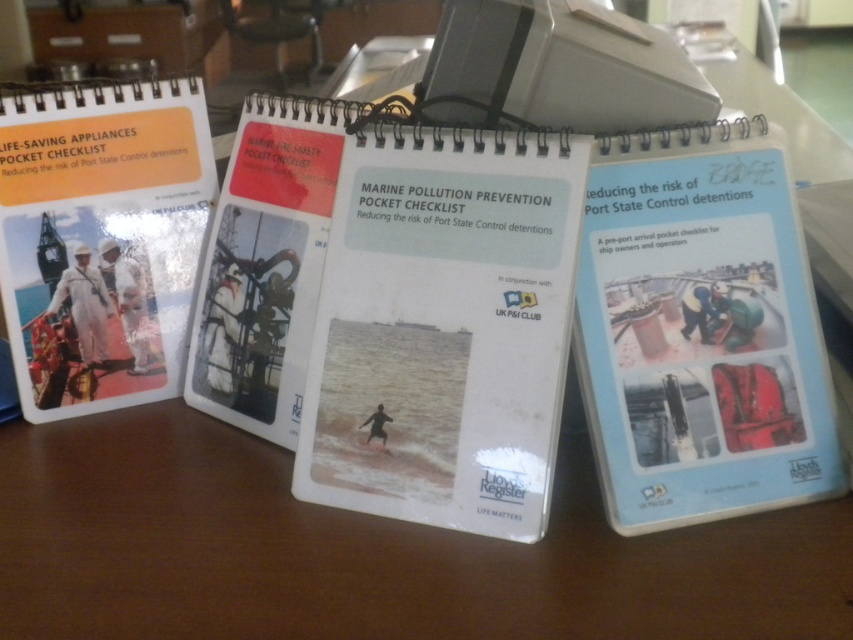
Does white plastic notebook at right have a smaller size compared to matte white book at left?

Correct, white plastic notebook at right occupies less space than matte white book at left.

At what (x,y) coordinates should I click in order to perform the action: click on white plastic notebook at right. Please return your answer as a coordinate pair (x, y). This screenshot has height=640, width=853. Looking at the image, I should click on (700, 330).

Image resolution: width=853 pixels, height=640 pixels. What are the coordinates of `white plastic notebook at right` in the screenshot? It's located at click(700, 330).

Who is taller, white paper notebook at center or matte white book at left?

white paper notebook at center

You are a GUI agent. You are given a task and a screenshot of the screen. Output one action in this format:
    pyautogui.click(x=<x>, y=<y>)
    Task: Click on the white paper notebook at center
    The image size is (853, 640).
    Given the screenshot: What is the action you would take?
    pyautogui.click(x=444, y=328)

Where is `white paper notebook at center`? white paper notebook at center is located at coordinates (444, 328).

Is white paper notebook at center shorter than white plastic notebook at right?

In fact, white paper notebook at center may be taller than white plastic notebook at right.

Who is lower down, white paper notebook at center or white plastic notebook at right?

Positioned lower is white paper notebook at center.

In order to click on white paper notebook at center in this screenshot , I will do `click(444, 328)`.